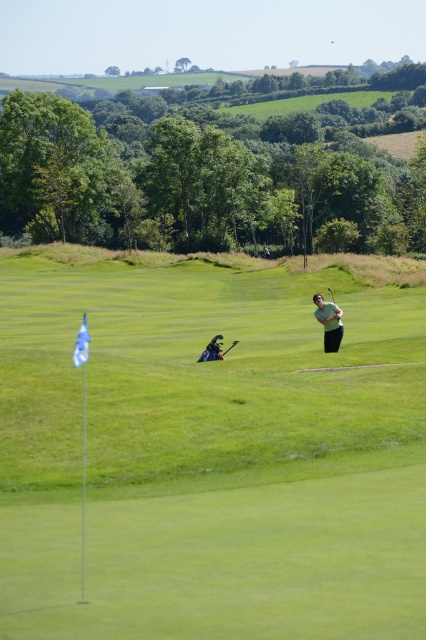
Question: Does green grassy golf course at center appear under shiny black golf club at center?

Choices:
 (A) no
 (B) yes

Answer: (A)

Question: Which object appears farthest from the camera in this image?

Choices:
 (A) green grassy golf course at center
 (B) light brown leather golf club at center

Answer: (B)

Question: Which object appears farthest from the camera in this image?

Choices:
 (A) light brown leather golf club at center
 (B) shiny black golf club at center
 (C) green grassy golf course at center

Answer: (A)

Question: Is green grassy golf course at center to the right of light brown leather golf club at center from the viewer's perspective?

Choices:
 (A) yes
 (B) no

Answer: (B)

Question: Among these points, which one is farthest from the camera?

Choices:
 (A) 319,321
 (B) 212,346
 (C) 293,496

Answer: (A)

Question: Does light brown leather golf club at center have a larger size compared to shiny black golf club at center?

Choices:
 (A) no
 (B) yes

Answer: (A)